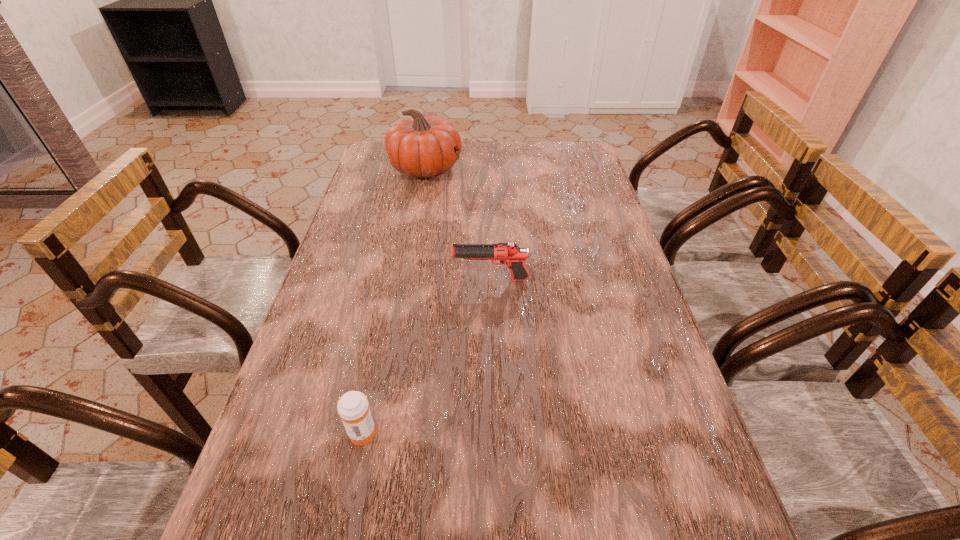
At what (x,y) coordinates should I click in order to perform the action: click on pumpkin that is at the left edge. Please return your answer as a coordinate pair (x, y). This screenshot has width=960, height=540. Looking at the image, I should click on (420, 146).

This screenshot has height=540, width=960. In order to click on medicine present at the left edge in this screenshot , I will do `click(353, 408)`.

Locate an element on the screen. object present at the far left corner is located at coordinates (420, 146).

The image size is (960, 540). I want to click on free region at the far edge of the desktop, so 534,141.

The height and width of the screenshot is (540, 960). Find the location of `free region at the left edge`. free region at the left edge is located at coordinates (376, 260).

In the image, there is a desktop. Where is `vacant space at the right edge`? vacant space at the right edge is located at coordinates (612, 420).

Locate an element on the screen. The image size is (960, 540). free region at the far left corner is located at coordinates tap(394, 172).

This screenshot has height=540, width=960. I want to click on vacant area at the far right corner, so click(x=581, y=144).

This screenshot has width=960, height=540. Identify the location of vacant space that's between the nearest object and the gun. (426, 356).

This screenshot has width=960, height=540. What are the coordinates of `free spot between the medicine and the gun` in the screenshot? It's located at (426, 356).